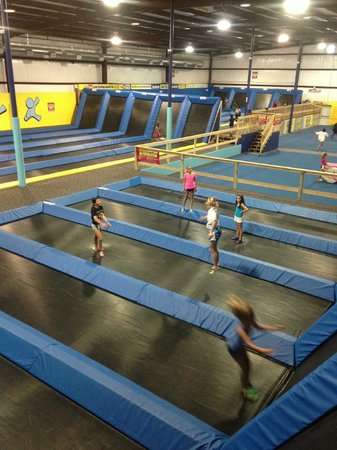
I want to click on staircase, so click(256, 144).